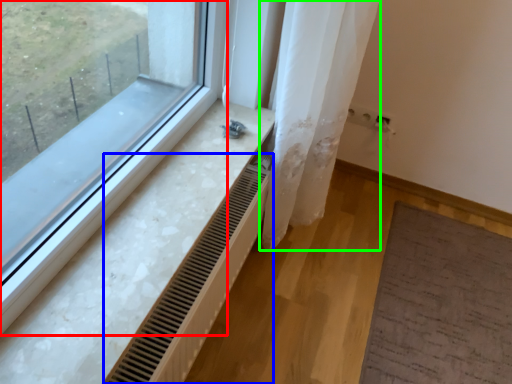
Question: Estimate the real-world distances between objects in this image. Which object is closer to window (highlighted by a red box), radiator (highlighted by a blue box) or shower curtain (highlighted by a green box)?

Choices:
 (A) radiator
 (B) shower curtain

Answer: (A)